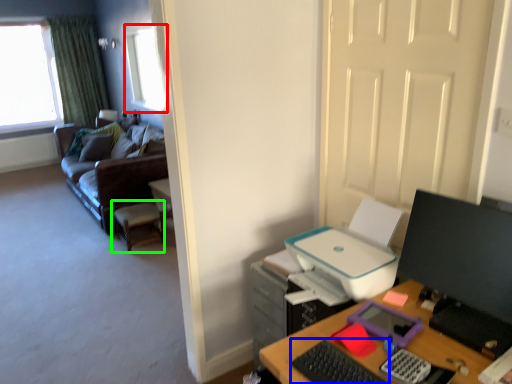
Question: Based on their relative distances, which object is farther from window (highlighted by a red box)? Choose from keyboard (highlighted by a blue box) and computer chair (highlighted by a green box).

Choices:
 (A) keyboard
 (B) computer chair

Answer: (A)